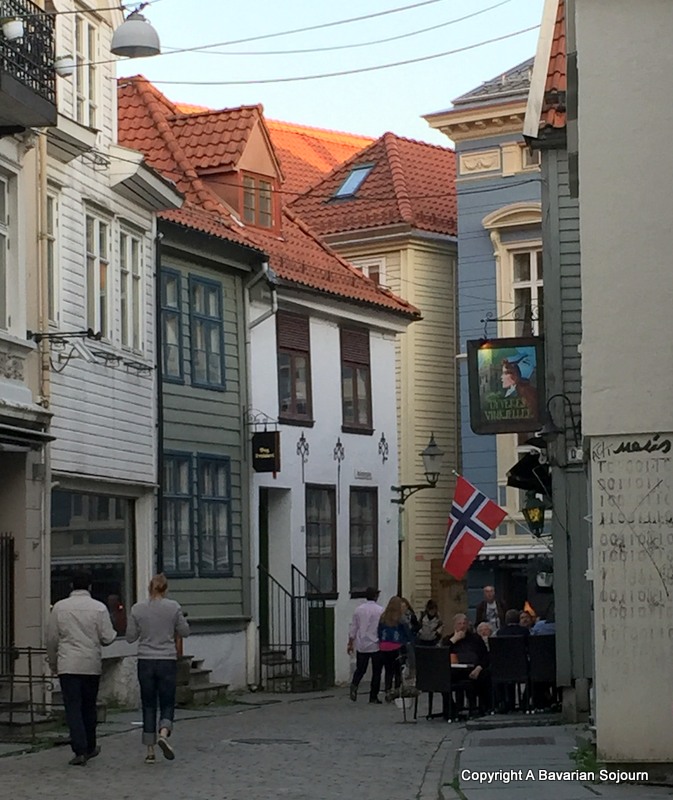
At what (x,y) coordinates should I click in order to perform the action: click on brown rectangular area over window. Please return your answer as a coordinate pair (x, y). The width and height of the screenshot is (673, 800). Looking at the image, I should click on (357, 346), (297, 334).